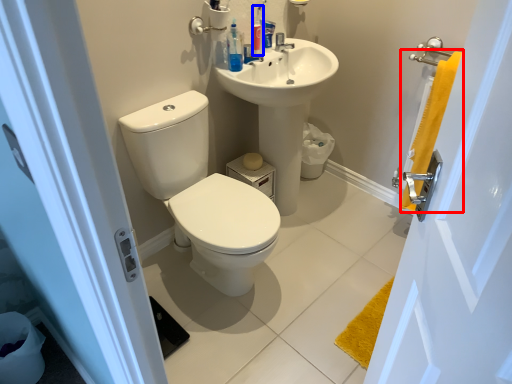
Question: Which of the following is the farthest to the observer, bath towel (highlighted by a red box) or toiletry (highlighted by a blue box)?

Choices:
 (A) bath towel
 (B) toiletry

Answer: (B)